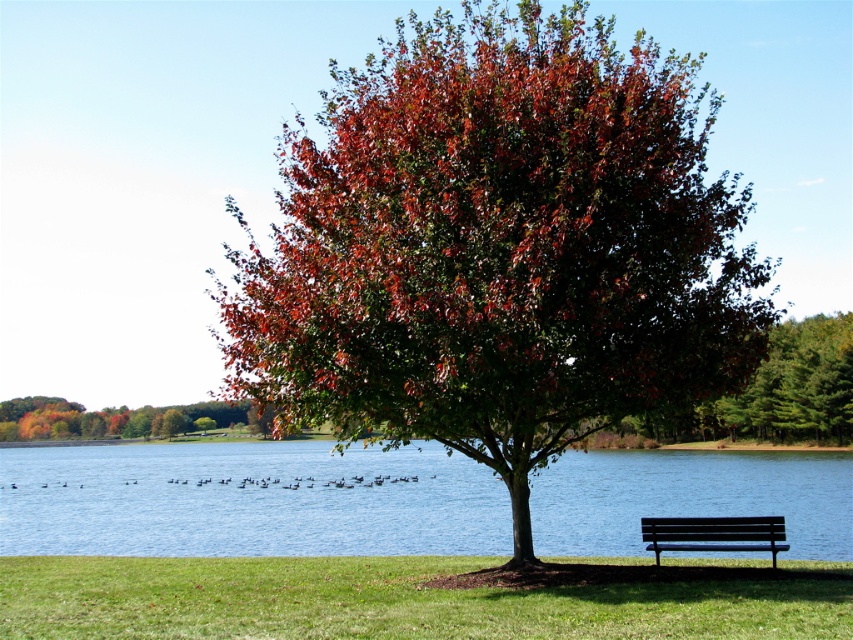
You are planning to take a photo of the black metal bench at lower right from the blue water at lower center. Can you see the entire bench in the photo if you position yourself at the water level?

The blue water at lower center has a greater height compared to the black metal bench at lower right. Since the water is higher, positioning yourself at water level would allow you to see the entire bench as it is lower in height.